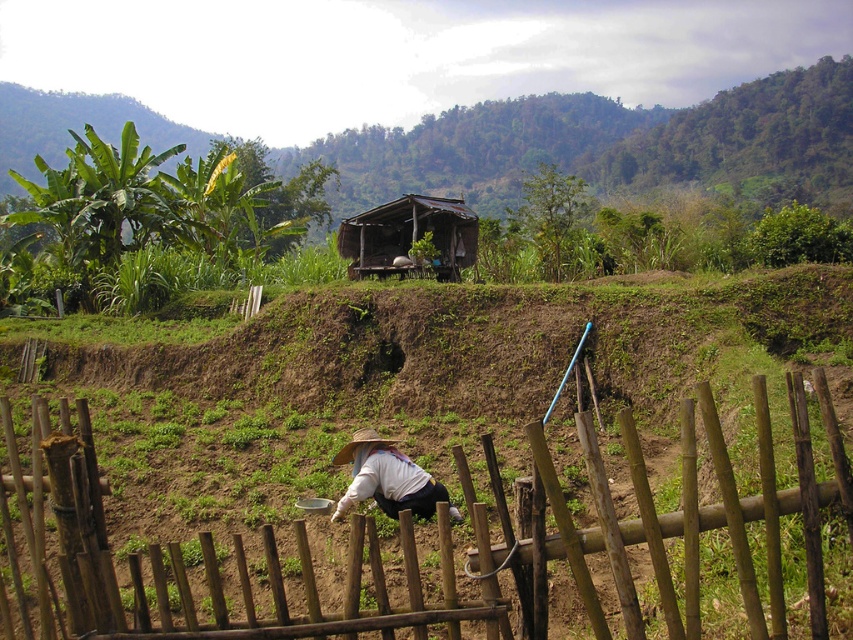
From the picture: You are a farmer who wants to place a new scarecrow exactly in the middle between the brown wooden fence at center and the white woven hat at lower center. Which object will the scarecrow be closer to?

The scarecrow will be closer to the white woven hat at lower center because the brown wooden fence at center is wider than the white woven hat at lower center, so the midpoint would be nearer to the smaller object.

You are a visitor in this rural area and want to find the brown thatched hut at center. Based on the scene description, where would you look to locate it?

The brown thatched hut at center is located at point 0.369 on the x axis and 0.481 on the y axis.

You are standing at the center of the image and want to reach the brown wooden fence at center. Which direction should you move to reach it?

The brown wooden fence at center is already at the center of the image, so you are already at its location.